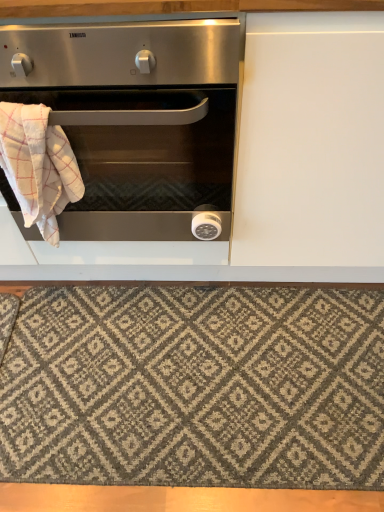
Question: Considering the positions of stainless steel oven at left and white checkered towel at left in the image, is stainless steel oven at left bigger or smaller than white checkered towel at left?

Choices:
 (A) big
 (B) small

Answer: (A)

Question: From the image's perspective, relative to white checkered towel at left, is stainless steel oven at left above or below?

Choices:
 (A) above
 (B) below

Answer: (A)

Question: Which object is the closest to the textured gray rug at lower center?

Choices:
 (A) stainless steel oven at left
 (B) white checkered towel at left

Answer: (A)

Question: Estimate the real-world distances between objects in this image. Which object is farther from the white checkered towel at left?

Choices:
 (A) textured gray rug at lower center
 (B) stainless steel oven at left

Answer: (A)